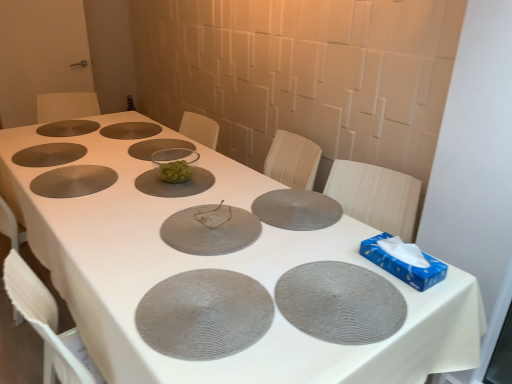
Where is `matte gray placemat at center, acting as the 7th glass plate starting from the back`? Image resolution: width=512 pixels, height=384 pixels. matte gray placemat at center, acting as the 7th glass plate starting from the back is located at coordinates tap(297, 209).

Describe the element at coordinates (210, 230) in the screenshot. I see `matte gray glass plate at center, which ranks as the eighth glass plate in back-to-front order` at that location.

Locate an element on the screen. The height and width of the screenshot is (384, 512). green glass bowl at center is located at coordinates (175, 164).

What is the approximate width of matte gray placemat at center?

matte gray placemat at center is 3.81 feet in width.

What do you see at coordinates (218, 268) in the screenshot?
I see `matte gray placemat at center` at bounding box center [218, 268].

Identify the location of matte gray placemat at center, which ranks as the 4th glass plate in front-to-back order. Image resolution: width=512 pixels, height=384 pixels. (297, 209).

Can matte gray glass plate at upper left, placed as the first glass plate when sorted from back to front, be found inside matte gray placemat at center, acting as the 7th glass plate starting from the back?

No, matte gray glass plate at upper left, placed as the first glass plate when sorted from back to front, is located outside of matte gray placemat at center, acting as the 7th glass plate starting from the back.

Are matte gray placemat at center, which ranks as the 4th glass plate in front-to-back order, and matte gray glass plate at upper left, placed as the first glass plate when sorted from back to front, far apart?

Yes.

Does point (315, 197) lie in front of point (52, 136)?

Yes, it is in front of point (52, 136).

Is matte gray placemat at center, acting as the 7th glass plate starting from the back, oriented towards matte gray glass plate at upper left, the 10th glass plate positioned from the front?

No, matte gray placemat at center, acting as the 7th glass plate starting from the back, is not aimed at matte gray glass plate at upper left, the 10th glass plate positioned from the front.

From the image's perspective, is matte gray glass plate at center, placed as the third glass plate when sorted from front to back, positioned above or below transparent glass bowl at center, arranged as the 8th glass plate when viewed from the front?

From the image's perspective, matte gray glass plate at center, placed as the third glass plate when sorted from front to back, appears below transparent glass bowl at center, arranged as the 8th glass plate when viewed from the front.

Is matte gray glass plate at center, which ranks as the eighth glass plate in back-to-front order, wider than transparent glass bowl at center, the third glass plate positioned from the back?

Correct, the width of matte gray glass plate at center, which ranks as the eighth glass plate in back-to-front order, exceeds that of transparent glass bowl at center, the third glass plate positioned from the back.

The image size is (512, 384). There is a transparent glass bowl at center, arranged as the 8th glass plate when viewed from the front. Identify the location of the 5th glass plate below it (from the image's perspective). (210, 230).

Is there a large distance between matte gray glass plate at center, which ranks as the eighth glass plate in back-to-front order, and transparent glass bowl at center, the third glass plate positioned from the back?

Actually, matte gray glass plate at center, which ranks as the eighth glass plate in back-to-front order, and transparent glass bowl at center, the third glass plate positioned from the back, are a little close together.

Is matte gray placemat at center, which ranks as the 4th glass plate in front-to-back order, facing away from matte gray placemat at center?

Yes, matte gray placemat at center, which ranks as the 4th glass plate in front-to-back order, is positioned with its back facing matte gray placemat at center.

In the scene shown: From the image's perspective, does matte gray placemat at center, acting as the 7th glass plate starting from the back, appear lower than matte gray placemat at center?

No, from the image's perspective, matte gray placemat at center, acting as the 7th glass plate starting from the back, is not below matte gray placemat at center.

How different are the orientations of matte gray placemat at center, acting as the 7th glass plate starting from the back, and matte gray placemat at center in degrees?

The angular difference between matte gray placemat at center, acting as the 7th glass plate starting from the back, and matte gray placemat at center is 178 degrees.

From the image's perspective, between matte gray placemat at center and matte brown glass plate at center, which appears as the ninth glass plate when viewed from the front, who is located below?

matte gray placemat at center appears lower in the image.

Is matte gray placemat at center bigger or smaller than matte brown glass plate at center, which appears as the ninth glass plate when viewed from the front?

In the image, matte gray placemat at center appears to be larger than matte brown glass plate at center, which appears as the ninth glass plate when viewed from the front.

From their relative heights in the image, would you say matte gray placemat at center is taller or shorter than matte brown glass plate at center, which appears as the ninth glass plate when viewed from the front?

In the image, matte gray placemat at center appears to be taller than matte brown glass plate at center, which appears as the ninth glass plate when viewed from the front.

Can gray textured placemat at lower right, arranged as the ninth glass plate when viewed from the back, be found inside clear glass bowl at center, marked as the 6th glass plate in a front-to-back arrangement?

No, gray textured placemat at lower right, arranged as the ninth glass plate when viewed from the back, is not inside clear glass bowl at center, marked as the 6th glass plate in a front-to-back arrangement.

The image size is (512, 384). Find the location of `glass plate that is the 4th object to the right of the clear glass bowl at center, acting as the 5th glass plate starting from the back, starting at the anchor`. glass plate that is the 4th object to the right of the clear glass bowl at center, acting as the 5th glass plate starting from the back, starting at the anchor is located at coordinates (340, 303).

Considering the sizes of objects clear glass bowl at center, marked as the 6th glass plate in a front-to-back arrangement, and gray textured placemat at lower right, arranged as the ninth glass plate when viewed from the back, in the image provided, who is smaller, clear glass bowl at center, marked as the 6th glass plate in a front-to-back arrangement, or gray textured placemat at lower right, arranged as the ninth glass plate when viewed from the back,?

Smaller between the two is clear glass bowl at center, marked as the 6th glass plate in a front-to-back arrangement.

In the scene shown: Considering the sizes of objects clear glass bowl at center, acting as the 5th glass plate starting from the back, and gray textured placemat at lower right, which ranks as the second glass plate in front-to-back order, in the image provided, who is shorter, clear glass bowl at center, acting as the 5th glass plate starting from the back, or gray textured placemat at lower right, which ranks as the second glass plate in front-to-back order,?

clear glass bowl at center, acting as the 5th glass plate starting from the back.

Consider the image. Can you tell me how much transparent glass bowl at center, the third glass plate positioned from the back, and matte gray glass plate at upper left, placed as the first glass plate when sorted from back to front, differ in facing direction?

transparent glass bowl at center, the third glass plate positioned from the back, and matte gray glass plate at upper left, placed as the first glass plate when sorted from back to front, are facing 88.2 degrees away from each other.

Where is `glass plate that is the 5th one below the transparent glass bowl at center, arranged as the 8th glass plate when viewed from the front (from a real-world perspective)`? The image size is (512, 384). glass plate that is the 5th one below the transparent glass bowl at center, arranged as the 8th glass plate when viewed from the front (from a real-world perspective) is located at coordinates (68, 128).

Is transparent glass bowl at center, the third glass plate positioned from the back, directly adjacent to matte gray glass plate at upper left, placed as the first glass plate when sorted from back to front?

They are not placed beside each other.

In terms of size, does transparent glass bowl at center, the third glass plate positioned from the back, appear bigger or smaller than matte gray glass plate at upper left, placed as the first glass plate when sorted from back to front?

transparent glass bowl at center, the third glass plate positioned from the back, is smaller than matte gray glass plate at upper left, placed as the first glass plate when sorted from back to front.

Based on the photo, considering the relative positions of green glass bowl at center and matte brown glass plate at center, which appears as the ninth glass plate when viewed from the front, in the image provided, is green glass bowl at center in front of matte brown glass plate at center, which appears as the ninth glass plate when viewed from the front,?

Yes, it is in front of matte brown glass plate at center, which appears as the ninth glass plate when viewed from the front.

From a real-world perspective, who is located higher, green glass bowl at center or matte brown glass plate at center, which appears as the second glass plate when viewed from the back?

From a 3D spatial view, green glass bowl at center is above.

Are green glass bowl at center and matte brown glass plate at center, which appears as the second glass plate when viewed from the back, making contact?

No, green glass bowl at center is not touching matte brown glass plate at center, which appears as the second glass plate when viewed from the back.

Considering the relative sizes of green glass bowl at center and matte brown glass plate at center, which appears as the ninth glass plate when viewed from the front, in the image provided, is green glass bowl at center wider than matte brown glass plate at center, which appears as the ninth glass plate when viewed from the front,?

No.

In order to click on the 1st glass plate directly above the matte gray placemat at center, acting as the 7th glass plate starting from the back (from a real-world perspective) in this screenshot , I will do `click(68, 128)`.

You are a GUI agent. You are given a task and a screenshot of the screen. Output one action in this format:
    pyautogui.click(x=<x>, y=<y>)
    Task: Click on the 5th glass plate below when counting from the transparent glass bowl at center, the third glass plate positioned from the back (from the image's perspective)
    This screenshot has height=384, width=512.
    Given the screenshot: What is the action you would take?
    coord(210,230)

From the picture: From the image, which object appears to be nearer to matte gray placemat at center, acting as the 7th glass plate starting from the back, matte gray glass plate at center, which ranks as the eighth glass plate in back-to-front order, or matte brown glass plate at center, which appears as the ninth glass plate when viewed from the front?

matte gray glass plate at center, which ranks as the eighth glass plate in back-to-front order, is positioned closer to the anchor matte gray placemat at center, acting as the 7th glass plate starting from the back.

Considering their positions, is matte gray glass plate at upper left, the 10th glass plate positioned from the front, positioned further to matte brown glass plate at center, which appears as the second glass plate when viewed from the back, than matte gray placemat at center, acting as the 7th glass plate starting from the back?

matte gray placemat at center, acting as the 7th glass plate starting from the back, lies further to matte brown glass plate at center, which appears as the second glass plate when viewed from the back, than the other object.

From the image, which object appears to be farther from matte gray plate at upper left, which is the 7th glass plate in front-to-back order, clear glass bowl at center, marked as the 6th glass plate in a front-to-back arrangement, or matte gray placemat at left, which appears as the fifth glass plate when viewed from the front?

clear glass bowl at center, marked as the 6th glass plate in a front-to-back arrangement, is positioned further to the anchor matte gray plate at upper left, which is the 7th glass plate in front-to-back order.

Estimate the real-world distances between objects in this image. Which object is further from clear glass bowl at center, acting as the 5th glass plate starting from the back, matte gray glass plate at center, placed as the third glass plate when sorted from front to back, or matte gray glass plate at upper left, the 10th glass plate positioned from the front?

matte gray glass plate at upper left, the 10th glass plate positioned from the front, is positioned further to the anchor clear glass bowl at center, acting as the 5th glass plate starting from the back.

Consider the image. When comparing their distances from matte gray placemat at left, which appears as the fifth glass plate when viewed from the front, does matte gray glass plate at upper left, placed as the first glass plate when sorted from back to front, or gray textured placemat at lower right, which ranks as the second glass plate in front-to-back order, seem closer?

Among the two, matte gray glass plate at upper left, placed as the first glass plate when sorted from back to front, is located nearer to matte gray placemat at left, which appears as the fifth glass plate when viewed from the front.

Which object lies nearer to the anchor point matte brown glass plate at center, which appears as the second glass plate when viewed from the back, gray textured placemat at center, marked as the 1th glass plate in a front-to-back arrangement, or matte gray placemat at center, acting as the 7th glass plate starting from the back?

matte gray placemat at center, acting as the 7th glass plate starting from the back, is closer to matte brown glass plate at center, which appears as the second glass plate when viewed from the back.

Looking at the image, which one is located further to matte gray placemat at center, which ranks as the 4th glass plate in front-to-back order, clear glass bowl at center, marked as the 6th glass plate in a front-to-back arrangement, or green glass bowl at center?

Based on the image, green glass bowl at center appears to be further to matte gray placemat at center, which ranks as the 4th glass plate in front-to-back order.

Considering their positions, is matte gray placemat at center, acting as the 7th glass plate starting from the back, positioned closer to matte gray placemat at left, which appears as the fifth glass plate when viewed from the front, than clear glass bowl at center, marked as the 6th glass plate in a front-to-back arrangement?

clear glass bowl at center, marked as the 6th glass plate in a front-to-back arrangement, is closer to matte gray placemat at left, which appears as the fifth glass plate when viewed from the front.

Locate an element on the screen. Image resolution: width=512 pixels, height=384 pixels. tableware situated between matte gray plate at upper left, which is the 7th glass plate in front-to-back order, and gray textured placemat at lower right, which ranks as the second glass plate in front-to-back order, from left to right is located at coordinates (175, 164).

At what (x,y) coordinates should I click in order to perform the action: click on tableware between gray textured placemat at center, positioned as the 10th glass plate in back-to-front order, and matte brown glass plate at center, which appears as the ninth glass plate when viewed from the front, in the front-back direction. Please return your answer as a coordinate pair (x, y). This screenshot has width=512, height=384. Looking at the image, I should click on (175, 164).

The image size is (512, 384). What are the coordinates of `tableware between matte gray placemat at left, which appears as the sixth glass plate when viewed from the back, and clear glass bowl at center, acting as the 5th glass plate starting from the back, in the horizontal direction` in the screenshot? It's located at (175, 164).

The height and width of the screenshot is (384, 512). In order to click on tableware positioned between matte gray placemat at center and transparent glass bowl at center, the third glass plate positioned from the back, from near to far in this screenshot , I will do `click(175, 164)`.